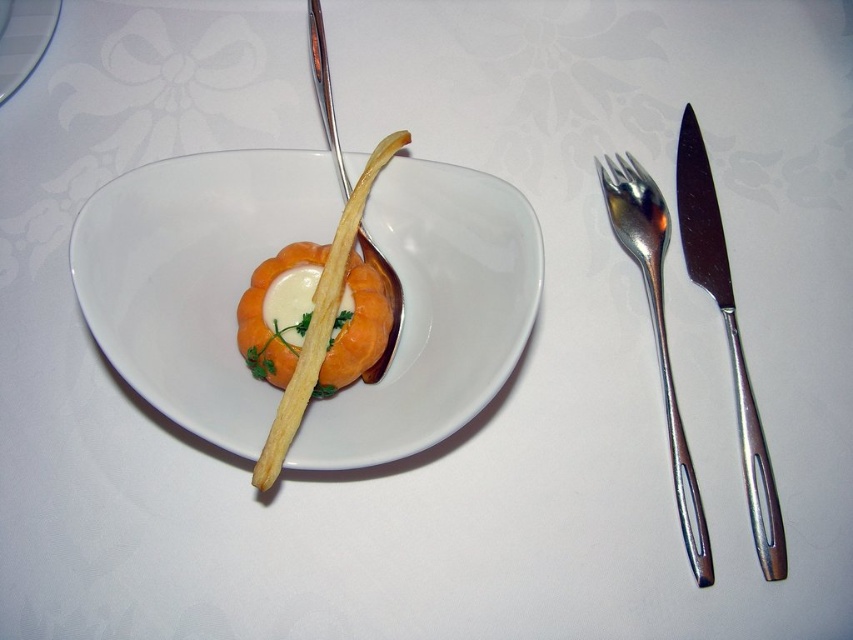
You are a food critic evaluating this dish. The salmon must be served on a plate that is at least 20 cm in diameter. Can you determine if the white glossy plate at center is large enough to accommodate the orange matte salmon at center?

The orange matte salmon at center has a larger size compared to the white glossy plate at center. Therefore, the white glossy plate at center may not be large enough to accommodate the orange matte salmon at center without overflowing.

From the picture: You are a chef preparing to serve this dish. You need to place a napkin that is 10 cm wide between the silver metallic fork at right and the white glossy plate at center. Can the napkin fit horizontally between them?

The silver metallic fork at right is wider than the white glossy plate at center. Since the napkin is 10 cm wide, it depends on the actual width of the fork and plate. However, without specific measurements, we cannot confirm if the napkin will fit horizontally between them.

You are a waiter who needs to place a napkin on the table. The napkin must be placed exactly at the point with coordinates point [194,276]. Where should you place the napkin relative to the white glossy bowl at center?

The point point [194,276] is located on the white glossy bowl at center, so you should place the napkin directly on top of the white glossy bowl at center.